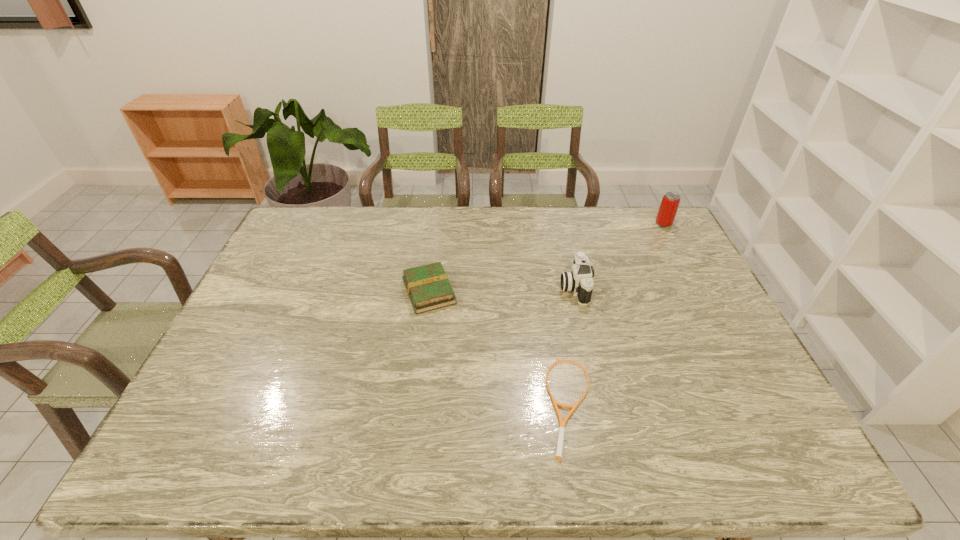
Locate an element on the screen. Image resolution: width=960 pixels, height=540 pixels. vacant space that's between the tennis racket and the third shortest object is located at coordinates (573, 346).

At what (x,y) coordinates should I click in order to perform the action: click on vacant space that's between the rightmost object and the second tallest object. Please return your answer as a coordinate pair (x, y). Looking at the image, I should click on (619, 255).

Identify the location of vacant point located between the third shortest object and the farthest object. (619, 255).

In order to click on free point between the book and the shortest object in this screenshot , I will do `click(501, 348)`.

Where is `vacant space that is in between the second tallest object and the nearest object`? This screenshot has width=960, height=540. vacant space that is in between the second tallest object and the nearest object is located at coordinates (573, 346).

Find the location of a particular element. This screenshot has height=540, width=960. unoccupied position between the farthest object and the third shortest object is located at coordinates (619, 255).

This screenshot has width=960, height=540. Find the location of `vacant area that lies between the second tallest object and the shortest object`. vacant area that lies between the second tallest object and the shortest object is located at coordinates (573, 346).

Locate an element on the screen. The image size is (960, 540). free space between the tennis racket and the farthest object is located at coordinates (618, 314).

You are a GUI agent. You are given a task and a screenshot of the screen. Output one action in this format:
    pyautogui.click(x=<x>, y=<y>)
    Task: Click on the free spot between the leftmost object and the nearest object
    
    Given the screenshot: What is the action you would take?
    pyautogui.click(x=501, y=348)

Identify which object is located as the third nearest to the nearest object. Please provide its 2D coordinates. Your answer should be formatted as a tuple, i.e. [(x, y)], where the tuple contains the x and y coordinates of a point satisfying the conditions above.

[(669, 205)]